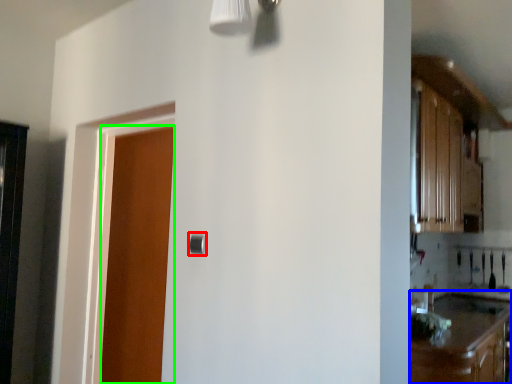
Question: Which object is positioned farthest from door handle (highlighted by a red box)? Select from cabinetry (highlighted by a blue box) and door (highlighted by a green box).

Choices:
 (A) cabinetry
 (B) door

Answer: (A)